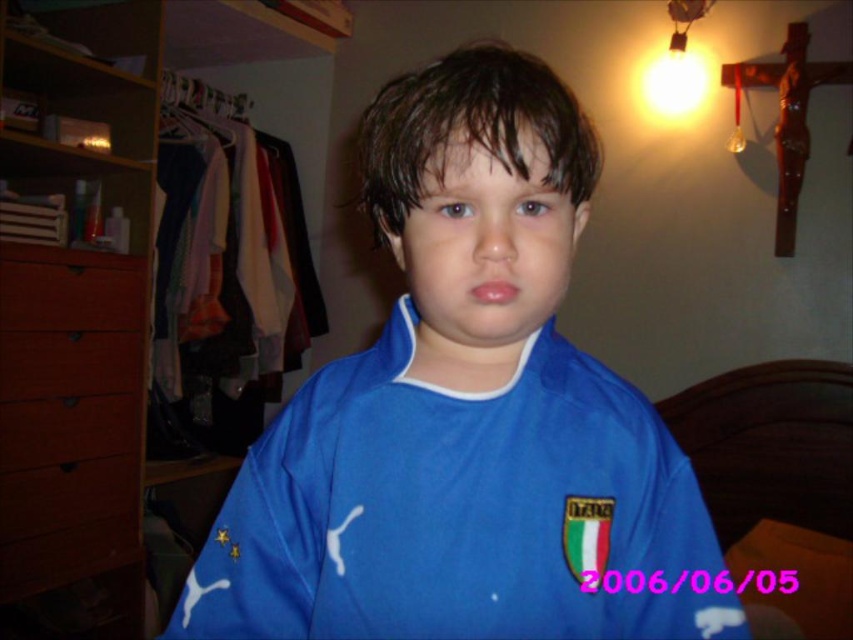
You are helping a child choose an outfit. The blue fabric shirt at center and the brown wood drawer at left are in view. Which item is wider?

The blue fabric shirt at center is wider than the brown wood drawer at left.

You are holding a small toy that is 3 inches wide. You want to place it on the floor near the point marked at coordinate [573,460]. Can you estimate whether the space there is wide enough to fit the toy without it overlapping with any furniture?

The point at coordinate [573,460] is 16.79 inches away from the viewer. Since the toy is only 3 inches wide, there should be sufficient space to place it there without overlapping any furniture.

You are organizing a child room and need to place a new toy box. You see the brown wood dresser at left and the brown wood drawer at left. Which one is lower in the image?

The brown wood dresser at left is located below the brown wood drawer at left, so the dresser is lower in the image.